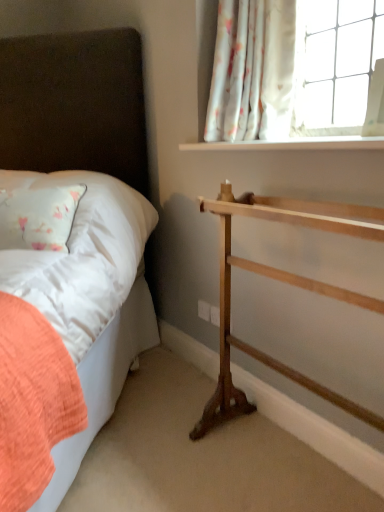
You are a GUI agent. You are given a task and a screenshot of the screen. Output one action in this format:
    pyautogui.click(x=<x>, y=<y>)
    Task: Click on the white smooth window sill at upper right
    
    Given the screenshot: What is the action you would take?
    pyautogui.click(x=293, y=144)

Describe the element at coordinates (285, 282) in the screenshot. The width and height of the screenshot is (384, 512). I see `natural wood towel rack at right` at that location.

Identify the location of matte white bed at left. (74, 104).

Describe the element at coordinates (256, 71) in the screenshot. I see `white floral fabric at upper right` at that location.

Where is `white smooth window sill at upper right`? white smooth window sill at upper right is located at coordinates (293, 144).

Is white floral fabric at upper right completely or partially inside matte white bed at left?

No, matte white bed at left does not contain white floral fabric at upper right.

How far apart are matte white bed at left and white floral fabric at upper right?

They are 70.69 centimeters apart.

Which of these two, matte white bed at left or white floral fabric at upper right, stands shorter?

Standing shorter between the two is white floral fabric at upper right.

From a real-world perspective, is matte white bed at left on white floral fabric at upper right?

No, from a real-world perspective, matte white bed at left is not above white floral fabric at upper right.

Is white floral fabric at upper right positioned beyond the bounds of matte white bed at left?

That's correct, white floral fabric at upper right is outside of matte white bed at left.

Locate an element on the screen. curtain above the matte white bed at left (from a real-world perspective) is located at coordinates (256, 71).

Is white floral fabric at upper right bigger or smaller than matte white bed at left?

Clearly, white floral fabric at upper right is smaller in size than matte white bed at left.

From a real-world perspective, is white floral fabric at upper right positioned over matte white bed at left based on gravity?

Correct, in the physical world, white floral fabric at upper right is higher than matte white bed at left.

From their relative heights in the image, would you say natural wood towel rack at right is taller or shorter than matte white bed at left?

Considering their sizes, natural wood towel rack at right has less height than matte white bed at left.

From the image's perspective, between natural wood towel rack at right and matte white bed at left, who is located below?

natural wood towel rack at right.

From a real-world perspective, between natural wood towel rack at right and matte white bed at left, who is vertically lower?

In real-world perspective, natural wood towel rack at right is lower.

Is white smooth window sill at upper right positioned with its back to matte white bed at left?

white smooth window sill at upper right is not turned away from matte white bed at left.

Between point (299, 142) and point (14, 74), which one is positioned in front?

Point (299, 142)

Considering the sizes of white smooth window sill at upper right and matte white bed at left in the image, is white smooth window sill at upper right wider or thinner than matte white bed at left?

Clearly, white smooth window sill at upper right has less width compared to matte white bed at left.

Does white smooth window sill at upper right have a greater height compared to matte white bed at left?

Incorrect, the height of white smooth window sill at upper right is not larger of that of matte white bed at left.

Who is taller, white floral fabric at upper right or white smooth window sill at upper right?

white floral fabric at upper right.

Are white floral fabric at upper right and white smooth window sill at upper right far apart?

white floral fabric at upper right is near white smooth window sill at upper right, not far away.

You are a GUI agent. You are given a task and a screenshot of the screen. Output one action in this format:
    pyautogui.click(x=<x>, y=<y>)
    Task: Click on the curtain that is above the white smooth window sill at upper right (from the image's perspective)
    This screenshot has width=384, height=512.
    Given the screenshot: What is the action you would take?
    [256, 71]

Is white floral fabric at upper right closer to the viewer compared to white smooth window sill at upper right?

No, the depth of white floral fabric at upper right is greater than that of white smooth window sill at upper right.

Is white smooth window sill at upper right shorter than white floral fabric at upper right?

Yes.

Which is behind, point (256, 148) or point (211, 131)?

The point (211, 131) is farther from the camera.

Is white smooth window sill at upper right far from white floral fabric at upper right?

Actually, white smooth window sill at upper right and white floral fabric at upper right are a little close together.

Based on the photo, could you tell me if white smooth window sill at upper right is turned towards white floral fabric at upper right?

No, white smooth window sill at upper right is not turned towards white floral fabric at upper right.

How different are the orientations of white floral fabric at upper right and natural wood towel rack at right in degrees?

white floral fabric at upper right and natural wood towel rack at right are facing 0.00162 degrees away from each other.

Can you confirm if white floral fabric at upper right is shorter than natural wood towel rack at right?

Correct, white floral fabric at upper right is not as tall as natural wood towel rack at right.

Does point (276, 19) appear closer or farther from the camera than point (220, 277)?

Point (276, 19) is positioned farther from the camera compared to point (220, 277).

From a real-world perspective, is white floral fabric at upper right over natural wood towel rack at right?

Yes, from a real-world perspective, white floral fabric at upper right is over natural wood towel rack at right

Locate an element on the screen. The image size is (384, 512). curtain behind the matte white bed at left is located at coordinates (256, 71).

Where is `curtain above the matte white bed at left (from the image's perspective)`? The width and height of the screenshot is (384, 512). curtain above the matte white bed at left (from the image's perspective) is located at coordinates (256, 71).

Looking at the image, which one is located further to natural wood towel rack at right, white floral fabric at upper right or white smooth window sill at upper right?

Based on the image, white floral fabric at upper right appears to be further to natural wood towel rack at right.

Based on their spatial positions, is natural wood towel rack at right or white smooth window sill at upper right closer to matte white bed at left?

Among the two, white smooth window sill at upper right is located nearer to matte white bed at left.

When comparing their distances from white smooth window sill at upper right, does natural wood towel rack at right or matte white bed at left seem closer?

natural wood towel rack at right lies closer to white smooth window sill at upper right than the other object.

When comparing their distances from matte white bed at left, does natural wood towel rack at right or white floral fabric at upper right seem closer?

The object closer to matte white bed at left is white floral fabric at upper right.

Which object lies nearer to the anchor point natural wood towel rack at right, white smooth window sill at upper right or white floral fabric at upper right?

Based on the image, white smooth window sill at upper right appears to be nearer to natural wood towel rack at right.

Based on their spatial positions, is white smooth window sill at upper right or matte white bed at left further from white floral fabric at upper right?

Based on the image, matte white bed at left appears to be further to white floral fabric at upper right.

Estimate the real-world distances between objects in this image. Which object is closer to matte white bed at left, white floral fabric at upper right or natural wood towel rack at right?

Based on the image, white floral fabric at upper right appears to be nearer to matte white bed at left.

Looking at the image, which one is located closer to matte white bed at left, white floral fabric at upper right or white smooth window sill at upper right?

white floral fabric at upper right.

The width and height of the screenshot is (384, 512). What are the coordinates of `curtain located between matte white bed at left and natural wood towel rack at right in the left-right direction` in the screenshot? It's located at (256, 71).

The image size is (384, 512). Identify the location of curtain between matte white bed at left and white smooth window sill at upper right in the horizontal direction. (256, 71).

Find the location of `window sill between white floral fabric at upper right and natural wood towel rack at right from top to bottom`. window sill between white floral fabric at upper right and natural wood towel rack at right from top to bottom is located at coordinates (293, 144).

Locate an element on the screen. The width and height of the screenshot is (384, 512). shelf between matte white bed at left and white smooth window sill at upper right from left to right is located at coordinates (285, 282).